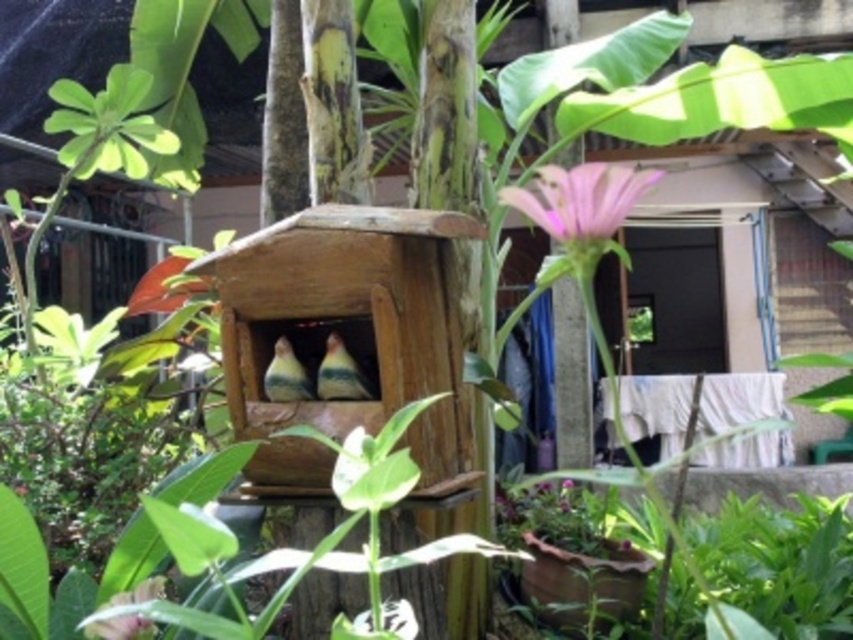
Can you confirm if pink matte flower at upper center is positioned above multicolored feathered bird at center?

Yes, pink matte flower at upper center is above multicolored feathered bird at center.

Where is `pink matte flower at upper center`? Image resolution: width=853 pixels, height=640 pixels. pink matte flower at upper center is located at coordinates (581, 198).

Does point (132, 632) come closer to viewer compared to point (305, 372)?

Yes, point (132, 632) is in front of point (305, 372).

Who is more distant from viewer, (x=112, y=632) or (x=286, y=353)?

The point (x=286, y=353) is more distant.

At what (x,y) coordinates should I click in order to perform the action: click on green matte flower at lower left. Please return your answer as a coordinate pair (x, y). Looking at the image, I should click on (120, 627).

Is wooden bird feeder at center closer to the viewer compared to pink matte flower at upper center?

Yes, wooden bird feeder at center is in front of pink matte flower at upper center.

Does point (322, 280) come farther from viewer compared to point (583, 182)?

That is False.

Identify the location of wooden bird feeder at center. The image size is (853, 640). (352, 324).